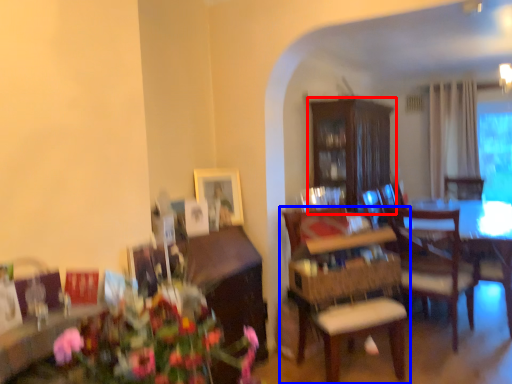
Question: Which object appears farthest to the camera in this image, cabinetry (highlighted by a red box) or chair (highlighted by a blue box)?

Choices:
 (A) cabinetry
 (B) chair

Answer: (A)